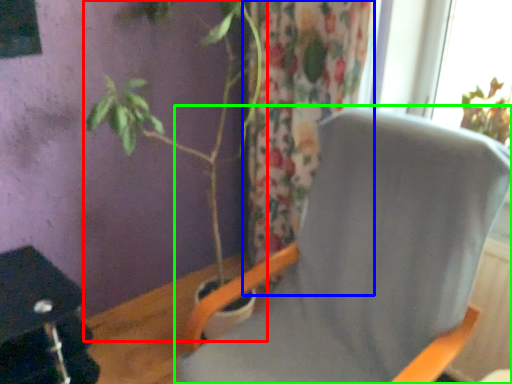
Question: Which is farther away from houseplant (highlighted by a red box)? curtain (highlighted by a blue box) or chair (highlighted by a green box)?

Choices:
 (A) curtain
 (B) chair

Answer: (B)